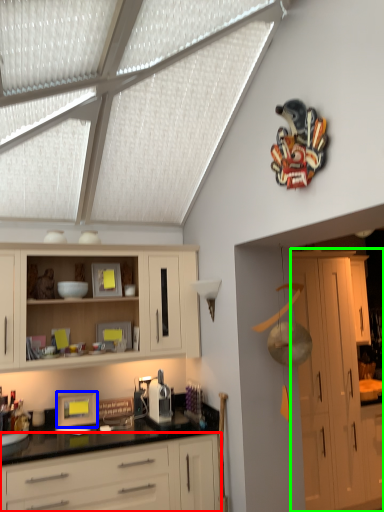
Question: Based on their relative distances, which object is farther from cabinetry (highlighted by a red box)? Choose from picture frame (highlighted by a blue box) and cabinetry (highlighted by a green box).

Choices:
 (A) picture frame
 (B) cabinetry

Answer: (B)